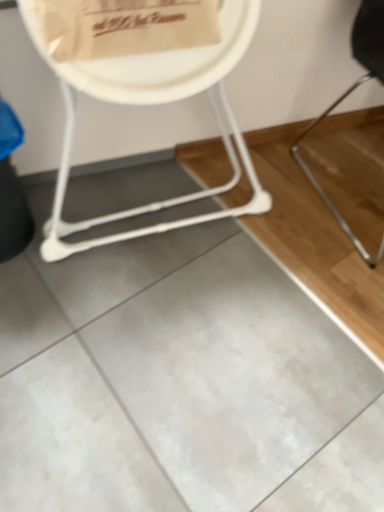
Question: Is white plastic chair at upper left, the 2th chair in the right-to-left sequence, in contact with black metal chair at right, the 2th chair positioned from the left?

Choices:
 (A) no
 (B) yes

Answer: (A)

Question: Is white plastic chair at upper left, the 2th chair in the right-to-left sequence, at the right side of black metal chair at right, the 1th chair positioned from the right?

Choices:
 (A) no
 (B) yes

Answer: (A)

Question: Is white plastic chair at upper left, the 2th chair in the right-to-left sequence, positioned with its back to black metal chair at right, the 2th chair positioned from the left?

Choices:
 (A) no
 (B) yes

Answer: (A)

Question: From the image's perspective, would you say white plastic chair at upper left, which is counted as the 1th chair, starting from the left, is shown under black metal chair at right, the 2th chair positioned from the left?

Choices:
 (A) yes
 (B) no

Answer: (A)

Question: Could you tell me if white plastic chair at upper left, which is counted as the 1th chair, starting from the left, is facing black metal chair at right, the 1th chair positioned from the right?

Choices:
 (A) yes
 (B) no

Answer: (B)

Question: Can you confirm if white plastic chair at upper left, which is counted as the 1th chair, starting from the left, is bigger than black metal chair at right, the 1th chair positioned from the right?

Choices:
 (A) no
 (B) yes

Answer: (B)

Question: Does black metal chair at right, the 1th chair positioned from the right, have a larger size compared to white paper plate at upper center?

Choices:
 (A) yes
 (B) no

Answer: (A)

Question: Can you confirm if black metal chair at right, the 1th chair positioned from the right, is shorter than white paper plate at upper center?

Choices:
 (A) no
 (B) yes

Answer: (A)

Question: Does black metal chair at right, the 2th chair positioned from the left, touch white paper plate at upper center?

Choices:
 (A) no
 (B) yes

Answer: (A)

Question: Is black metal chair at right, the 2th chair positioned from the left, oriented away from white paper plate at upper center?

Choices:
 (A) no
 (B) yes

Answer: (A)

Question: Can white paper plate at upper center be found inside black metal chair at right, the 2th chair positioned from the left?

Choices:
 (A) no
 (B) yes

Answer: (A)

Question: Is black metal chair at right, the 2th chair positioned from the left, positioned beyond the bounds of white paper plate at upper center?

Choices:
 (A) no
 (B) yes

Answer: (B)

Question: Does white plastic chair at upper left, which is counted as the 1th chair, starting from the left, come behind white paper plate at upper center?

Choices:
 (A) yes
 (B) no

Answer: (B)